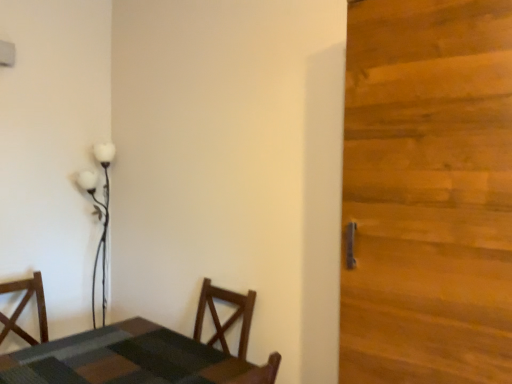
The width and height of the screenshot is (512, 384). What do you see at coordinates (133, 359) in the screenshot?
I see `textured wood table at lower left` at bounding box center [133, 359].

This screenshot has width=512, height=384. What do you see at coordinates (428, 192) in the screenshot?
I see `wooden door at right` at bounding box center [428, 192].

The width and height of the screenshot is (512, 384). I want to click on white glossy floor lamp at upper left, so click(x=99, y=215).

Could you tell me if wooden door at right is facing textured wood table at lower left?

No, wooden door at right is not turned towards textured wood table at lower left.

The height and width of the screenshot is (384, 512). Find the location of `door lying on the right of textured wood table at lower left`. door lying on the right of textured wood table at lower left is located at coordinates (428, 192).

In terms of width, does wooden door at right look wider or thinner when compared to textured wood table at lower left?

In the image, wooden door at right appears to be more narrow than textured wood table at lower left.

Could you tell me if wooden door at right is facing white glossy floor lamp at upper left?

No, wooden door at right is not oriented towards white glossy floor lamp at upper left.

Is wooden door at right behind white glossy floor lamp at upper left?

No, wooden door at right is in front of white glossy floor lamp at upper left.

From the image's perspective, does wooden door at right appear lower than white glossy floor lamp at upper left?

Actually, wooden door at right appears above white glossy floor lamp at upper left in the image.

Can you tell me how much wooden door at right and white glossy floor lamp at upper left differ in facing direction?

The angle between the facing direction of wooden door at right and the facing direction of white glossy floor lamp at upper left is 83.9 degrees.

Image resolution: width=512 pixels, height=384 pixels. Find the location of `table that appears on the left of wooden door at right`. table that appears on the left of wooden door at right is located at coordinates (133, 359).

From a real-world perspective, is textured wood table at lower left above or below wooden door at right?

Clearly, from a real-world perspective, textured wood table at lower left is below wooden door at right.

Are textured wood table at lower left and wooden door at right located far from each other?

Actually, textured wood table at lower left and wooden door at right are a little close together.

Is textured wood table at lower left further to camera compared to wooden door at right?

Yes, it is behind wooden door at right.

Measure the distance from white glossy floor lamp at upper left to textured wood table at lower left.

white glossy floor lamp at upper left and textured wood table at lower left are 1.15 meters apart from each other.

Is white glossy floor lamp at upper left turned away from textured wood table at lower left?

No, white glossy floor lamp at upper left's orientation is not away from textured wood table at lower left.

Which object is positioned more to the right, white glossy floor lamp at upper left or textured wood table at lower left?

textured wood table at lower left is more to the right.

Considering the positions of objects white glossy floor lamp at upper left and textured wood table at lower left in the image provided, who is behind, white glossy floor lamp at upper left or textured wood table at lower left?

white glossy floor lamp at upper left is behind.

From the image's perspective, is white glossy floor lamp at upper left located above wooden door at right?

Incorrect, from the image's perspective, white glossy floor lamp at upper left is lower than wooden door at right.

The width and height of the screenshot is (512, 384). Find the location of `door lying on the right of white glossy floor lamp at upper left`. door lying on the right of white glossy floor lamp at upper left is located at coordinates (428, 192).

Is the surface of white glossy floor lamp at upper left in direct contact with wooden door at right?

white glossy floor lamp at upper left and wooden door at right are clearly separated.

From the picture: Is white glossy floor lamp at upper left facing away from wooden door at right?

No, white glossy floor lamp at upper left is not facing away from wooden door at right.

Would you say textured wood table at lower left is a long distance from white glossy floor lamp at upper left?

textured wood table at lower left is far away from white glossy floor lamp at upper left.

The width and height of the screenshot is (512, 384). Find the location of `lamp behind the textured wood table at lower left`. lamp behind the textured wood table at lower left is located at coordinates (99, 215).

From the picture: From the image's perspective, which is above, textured wood table at lower left or white glossy floor lamp at upper left?

From the image's view, white glossy floor lamp at upper left is above.

From a real-world perspective, is textured wood table at lower left positioned above or below white glossy floor lamp at upper left?

From a real-world perspective, textured wood table at lower left is physically below white glossy floor lamp at upper left.

I want to click on table located behind the wooden door at right, so click(133, 359).

Locate an element on the screen. The width and height of the screenshot is (512, 384). door that is in front of the white glossy floor lamp at upper left is located at coordinates (428, 192).

Considering their positions, is wooden door at right positioned further to white glossy floor lamp at upper left than textured wood table at lower left?

Based on the image, wooden door at right appears to be further to white glossy floor lamp at upper left.

From the image, which object appears to be farther from white glossy floor lamp at upper left, textured wood table at lower left or wooden door at right?

Among the two, wooden door at right is located further to white glossy floor lamp at upper left.

Based on their spatial positions, is white glossy floor lamp at upper left or textured wood table at lower left further from wooden door at right?

white glossy floor lamp at upper left.

When comparing their distances from wooden door at right, does textured wood table at lower left or white glossy floor lamp at upper left seem closer?

textured wood table at lower left is closer to wooden door at right.

When comparing their distances from textured wood table at lower left, does wooden door at right or white glossy floor lamp at upper left seem closer?

wooden door at right is positioned closer to the anchor textured wood table at lower left.

Considering their positions, is white glossy floor lamp at upper left positioned further to textured wood table at lower left than wooden door at right?

Among the two, white glossy floor lamp at upper left is located further to textured wood table at lower left.

The width and height of the screenshot is (512, 384). I want to click on table between wooden door at right and white glossy floor lamp at upper left from front to back, so click(133, 359).